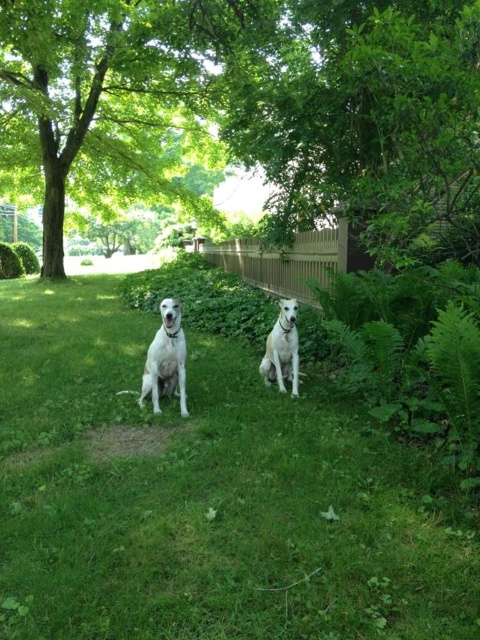
Can you confirm if white fur dog at center is shorter than white glossy dog at center?

No, white fur dog at center is not shorter than white glossy dog at center.

Who is lower down, white fur dog at center or white glossy dog at center?

white glossy dog at center

In the scene shown: Who is more forward, [159,358] or [261,372]?

Point [159,358]

Locate an element on the screen. Image resolution: width=480 pixels, height=640 pixels. white fur dog at center is located at coordinates (166, 358).

Locate an element on the screen. green leafy tree at center is located at coordinates (245, 108).

Is green leafy tree at center thinner than white fur dog at center?

In fact, green leafy tree at center might be wider than white fur dog at center.

Does point (446, 68) come in front of point (179, 344)?

Yes, point (446, 68) is in front of point (179, 344).

I want to click on green leafy tree at center, so click(x=245, y=108).

Image resolution: width=480 pixels, height=640 pixels. What are the coordinates of `green leafy tree at center` in the screenshot? It's located at (245, 108).

Does green leafy tree at center have a smaller size compared to white glossy dog at center?

No.

Is point (320, 141) positioned after point (278, 317)?

Yes, it is behind point (278, 317).

Identify the location of green leafy tree at center. (245, 108).